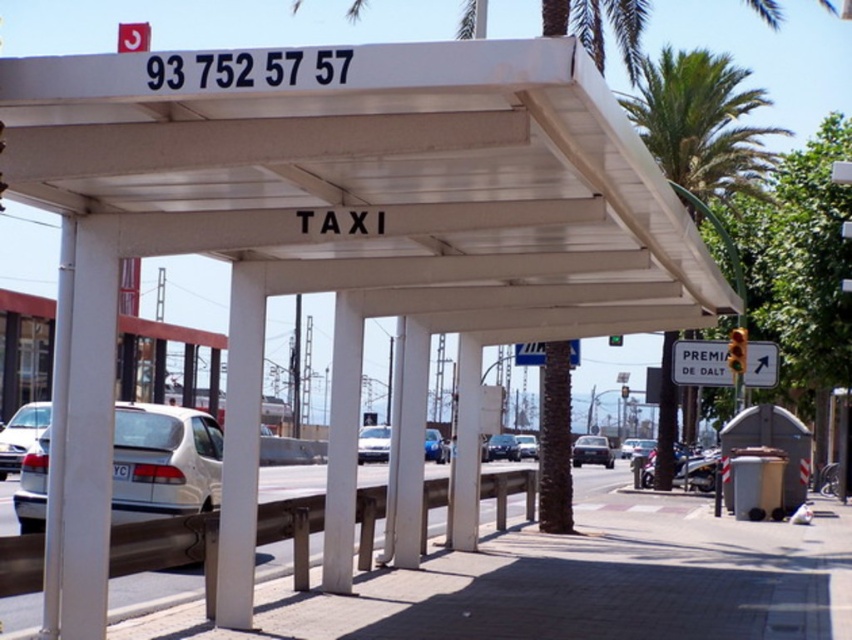
Does white plastic sign at upper right come behind metallic silver sedan at center?

Yes, it is behind metallic silver sedan at center.

Is point (751, 346) more distant than point (363, 445)?

No, (751, 346) is closer to viewer.

At what (x,y) coordinates should I click in order to perform the action: click on white plastic sign at upper right. Please return your answer as a coordinate pair (x, y). The height and width of the screenshot is (640, 852). Looking at the image, I should click on (701, 364).

Can you confirm if white plastic sign at center is positioned below metallic blue sedan at center?

No, white plastic sign at center is not below metallic blue sedan at center.

Can you confirm if white plastic sign at center is shorter than metallic blue sedan at center?

Indeed, white plastic sign at center has a lesser height compared to metallic blue sedan at center.

What do you see at coordinates (528, 353) in the screenshot? I see `white plastic sign at center` at bounding box center [528, 353].

Find the location of a particular element. The image size is (852, 640). white plastic sign at center is located at coordinates (528, 353).

Between white concrete pavement at center and metallic blue sedan at center, which one is positioned higher?

metallic blue sedan at center is above.

Which is behind, point (285, 554) or point (445, 452)?

Positioned behind is point (445, 452).

Is point (413, 576) positioned before point (435, 445)?

Yes.

Where is `white concrete pavement at center`? Image resolution: width=852 pixels, height=640 pixels. white concrete pavement at center is located at coordinates (565, 582).